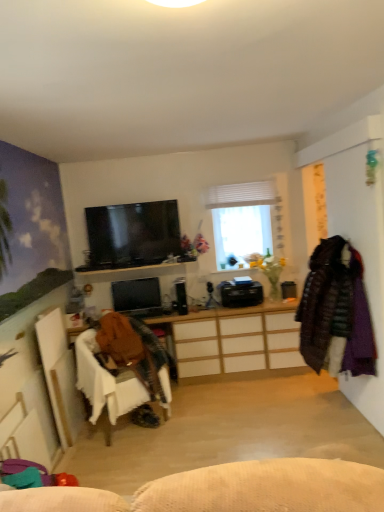
Question: Considering the positions of matte black monitor at center, the 1th television viewed from the back, and dark brown quilted coat at right, the second clothing when ordered from left to right, in the image, is matte black monitor at center, the 1th television viewed from the back, bigger or smaller than dark brown quilted coat at right, the second clothing when ordered from left to right,?

Choices:
 (A) small
 (B) big

Answer: (A)

Question: Considering the positions of point (125, 298) and point (311, 309), is point (125, 298) closer or farther from the camera than point (311, 309)?

Choices:
 (A) farther
 (B) closer

Answer: (A)

Question: Estimate the real-world distances between objects in this image. Which object is closer to the dark brown quilted coat at right, the second clothing when ordered from left to right?

Choices:
 (A) brown leather jacket at lower left, which ranks as the first clothing in left-to-right order
 (B) velvet purple coat at right
 (C) matte black monitor at center, which is counted as the 2th television, starting from the front
 (D) white matte window at center
 (E) black glossy tv at upper center, positioned as the first television in front-to-back order

Answer: (B)

Question: Considering the real-world distances, which object is closest to the velvet purple coat at right?

Choices:
 (A) matte black monitor at center, which ranks as the 2th television in top-to-bottom order
 (B) white fabric chair at lower left
 (C) black glossy tv at upper center, the second television in the bottom-to-top sequence
 (D) wooden desk at center
 (E) brown leather jacket at lower left, which ranks as the first clothing in left-to-right order

Answer: (D)